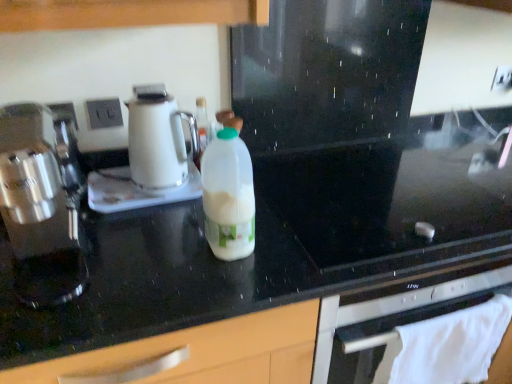
In order to click on white plastic electric outlet at upper center, which is the 2th electric outlet in bottom-to-top order in this screenshot , I will do 502,79.

Measure the distance between point (x=194, y=190) and camera.

Point (x=194, y=190) and camera are 1.15 meters apart from each other.

At what (x,y) coordinates should I click in order to perform the action: click on white glossy electric kettle at center, acting as the first kitchen appliance starting from the back. Please return your answer as a coordinate pair (x, y). Looking at the image, I should click on (158, 139).

At what (x,y) coordinates should I click in order to perform the action: click on white plastic bottle at center. Please return your answer as a coordinate pair (x, y). The image size is (512, 384). Looking at the image, I should click on (228, 196).

Is white plastic electric outlet at upper left, the 2th electric outlet in the back-to-front sequence, not near white glossy electric kettle at center, acting as the first kitchen appliance starting from the back?

No.

Which is behind, point (93, 117) or point (161, 177)?

The point (93, 117) is farther from the camera.

How many degrees apart are the facing directions of white plastic electric outlet at upper left, positioned as the 2th electric outlet in top-to-bottom order, and white glossy electric kettle at center, the second kitchen appliance from the front?

The angular difference between white plastic electric outlet at upper left, positioned as the 2th electric outlet in top-to-bottom order, and white glossy electric kettle at center, the second kitchen appliance from the front, is 1.57 degrees.

Does white plastic electric outlet at upper left, positioned as the 2th electric outlet in top-to-bottom order, turn towards white glossy electric kettle at center, the second kitchen appliance from the front?

No.

Does point (222, 195) lie behind point (312, 225)?

No, it is in front of (312, 225).

Measure the distance from white plastic bottle at center to black glass gas stove at center.

A distance of 13.50 inches exists between white plastic bottle at center and black glass gas stove at center.

Between white plastic bottle at center and black glass gas stove at center, which one has more height?

Standing taller between the two is white plastic bottle at center.

Is white plastic bottle at center looking in the opposite direction of black glass gas stove at center?

white plastic bottle at center does not have its back to black glass gas stove at center.

Considering the sizes of objects white cloth towel at lower right and white glossy kettle at center in the image provided, who is wider, white cloth towel at lower right or white glossy kettle at center?

white glossy kettle at center.

Would you say white cloth towel at lower right is inside or outside white glossy kettle at center?

white cloth towel at lower right is located beyond the bounds of white glossy kettle at center.

From a real-world perspective, is white cloth towel at lower right below white glossy kettle at center?

Yes, from a real-world perspective, white cloth towel at lower right is under white glossy kettle at center.

Is white cloth towel at lower right shorter than white glossy kettle at center?

In fact, white cloth towel at lower right may be taller than white glossy kettle at center.

Find the location of `home appliance that appears below the satin silver coffee maker at left, which is counted as the second kitchen appliance, starting from the back (from the image's perspective)`. home appliance that appears below the satin silver coffee maker at left, which is counted as the second kitchen appliance, starting from the back (from the image's perspective) is located at coordinates (400, 306).

Is white cloth towel at lower right next to satin silver coffee maker at left, which is counted as the second kitchen appliance, starting from the back?

No, white cloth towel at lower right is not beside satin silver coffee maker at left, which is counted as the second kitchen appliance, starting from the back.

Between white cloth towel at lower right and satin silver coffee maker at left, which is counted as the second kitchen appliance, starting from the back, which one has more height?

With more height is satin silver coffee maker at left, which is counted as the second kitchen appliance, starting from the back.

Is white glossy kettle at center beside white glossy electric kettle at center, the second kitchen appliance from the front?

Yes, the surface of white glossy kettle at center is in contact with white glossy electric kettle at center, the second kitchen appliance from the front.

Is point (145, 205) more distant than point (129, 135)?

No, it is not.

From the image's perspective, does white glossy kettle at center appear higher than white glossy electric kettle at center, acting as the first kitchen appliance starting from the back?

No, from the image's perspective, white glossy kettle at center is not over white glossy electric kettle at center, acting as the first kitchen appliance starting from the back.

Considering the positions of objects white glossy kettle at center and white glossy electric kettle at center, the second kitchen appliance from the front, in the image provided, who is more to the right, white glossy kettle at center or white glossy electric kettle at center, the second kitchen appliance from the front,?

white glossy electric kettle at center, the second kitchen appliance from the front, is more to the right.

Measure the distance between white glossy kettle at center and white plastic bottle at center.

11.07 inches.

Can white plastic bottle at center be found inside white glossy kettle at center?

No.

From a real-world perspective, is white glossy kettle at center positioned over white plastic bottle at center based on gravity?

No, from a real-world perspective, white glossy kettle at center is not on top of white plastic bottle at center.

Does white glossy kettle at center have a greater width compared to white plastic bottle at center?

Indeed, white glossy kettle at center has a greater width compared to white plastic bottle at center.

What's the angular difference between white cloth towel at lower right and white plastic electric outlet at upper left, the 2th electric outlet in the back-to-front sequence,'s facing directions?

The facing directions of white cloth towel at lower right and white plastic electric outlet at upper left, the 2th electric outlet in the back-to-front sequence, are 0.0256 degrees apart.

Is white cloth towel at lower right oriented away from white plastic electric outlet at upper left, positioned as the 2th electric outlet in top-to-bottom order?

No, white cloth towel at lower right is not facing away from white plastic electric outlet at upper left, positioned as the 2th electric outlet in top-to-bottom order.

Is white cloth towel at lower right positioned far away from white plastic electric outlet at upper left, acting as the first electric outlet starting from the left?

They are positioned close to each other.

This screenshot has height=384, width=512. In order to click on kitchen appliance that is the 2nd object directly below the white plastic electric outlet at upper left, acting as the first electric outlet starting from the left (from a real-world perspective) in this screenshot , I will do `click(158, 139)`.

The width and height of the screenshot is (512, 384). I want to click on gas stove behind the white plastic bottle at center, so click(386, 202).

Which object lies nearer to the anchor point black glass gas stove at center, satin silver coffee maker at left, which is counted as the second kitchen appliance, starting from the back, or white glossy electric kettle at center, acting as the first kitchen appliance starting from the back?

white glossy electric kettle at center, acting as the first kitchen appliance starting from the back, is closer to black glass gas stove at center.

Looking at this image, based on their spatial positions, is white glossy electric kettle at center, acting as the first kitchen appliance starting from the back, or white cloth towel at lower right closer to white plastic bottle at center?

white glossy electric kettle at center, acting as the first kitchen appliance starting from the back, is positioned closer to the anchor white plastic bottle at center.

From the image, which object appears to be nearer to white glossy kettle at center, black glass gas stove at center or white plastic bottle at center?

Among the two, white plastic bottle at center is located nearer to white glossy kettle at center.

From the image, which object appears to be nearer to satin silver coffee maker at left, which is counted as the second kitchen appliance, starting from the back, black glass gas stove at center or white cloth towel at lower right?

Among the two, white cloth towel at lower right is located nearer to satin silver coffee maker at left, which is counted as the second kitchen appliance, starting from the back.

From the image, which object appears to be nearer to white glossy electric kettle at center, the second kitchen appliance from the front, black glossy countertop at center or white plastic bottle at center?

The object closer to white glossy electric kettle at center, the second kitchen appliance from the front, is white plastic bottle at center.

Estimate the real-world distances between objects in this image. Which object is closer to white plastic electric outlet at upper left, placed as the second electric outlet when sorted from right to left, black glossy countertop at center or white plastic electric outlet at upper center, placed as the second electric outlet when sorted from left to right?

black glossy countertop at center is positioned closer to the anchor white plastic electric outlet at upper left, placed as the second electric outlet when sorted from right to left.

From the image, which object appears to be farther from white plastic bottle at center, white glossy kettle at center or satin silver coffee maker at left, which is counted as the second kitchen appliance, starting from the back?

satin silver coffee maker at left, which is counted as the second kitchen appliance, starting from the back, lies further to white plastic bottle at center than the other object.

Considering their positions, is black glass gas stove at center positioned further to white glossy electric kettle at center, the second kitchen appliance from the front, than white plastic electric outlet at upper center, the first electric outlet when ordered from top to bottom?

Among the two, white plastic electric outlet at upper center, the first electric outlet when ordered from top to bottom, is located further to white glossy electric kettle at center, the second kitchen appliance from the front.

You are a GUI agent. You are given a task and a screenshot of the screen. Output one action in this format:
    pyautogui.click(x=<x>, y=<y>)
    Task: Click on the appliance between satin silver coffee maker at left, arranged as the 1th kitchen appliance when viewed from the front, and white plastic electric outlet at upper center, the first electric outlet when ordered from top to bottom
    The width and height of the screenshot is (512, 384).
    Given the screenshot: What is the action you would take?
    pyautogui.click(x=136, y=190)

You are a GUI agent. You are given a task and a screenshot of the screen. Output one action in this format:
    pyautogui.click(x=<x>, y=<y>)
    Task: Click on the kitchen appliance located between white glossy kettle at center and white plastic electric outlet at upper center, placed as the first electric outlet when sorted from back to front, in the left-right direction
    
    Given the screenshot: What is the action you would take?
    pyautogui.click(x=158, y=139)

Locate an element on the screen. appliance situated between white plastic electric outlet at upper left, acting as the first electric outlet starting from the left, and black glossy countertop at center from left to right is located at coordinates (136, 190).

This screenshot has height=384, width=512. Find the location of `bottle situated between white plastic electric outlet at upper left, placed as the second electric outlet when sorted from right to left, and black glass gas stove at center from left to right`. bottle situated between white plastic electric outlet at upper left, placed as the second electric outlet when sorted from right to left, and black glass gas stove at center from left to right is located at coordinates (228, 196).